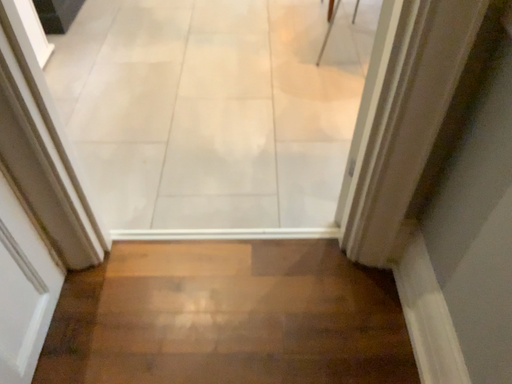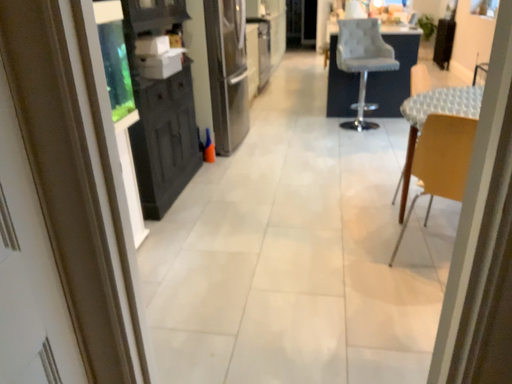
Question: Which way did the camera rotate in the video?

Choices:
 (A) rotated left
 (B) rotated right

Answer: (A)